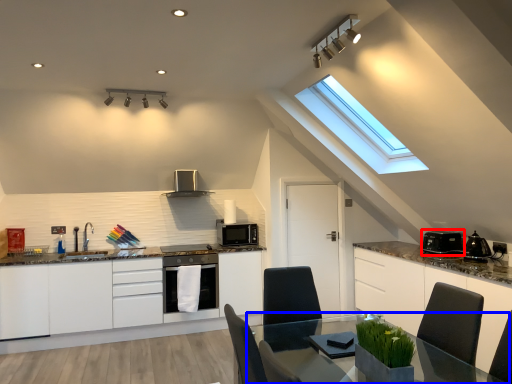
Question: Which object is closer to the camera taking this photo, appliance (highlighted by a red box) or table (highlighted by a blue box)?

Choices:
 (A) appliance
 (B) table

Answer: (B)